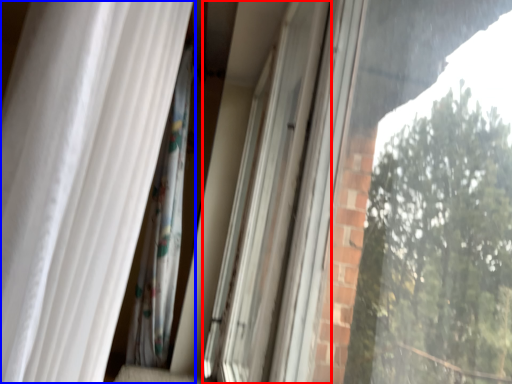
Question: Which of the following is the farthest to the observer, screen door (highlighted by a red box) or curtain (highlighted by a blue box)?

Choices:
 (A) screen door
 (B) curtain

Answer: (A)